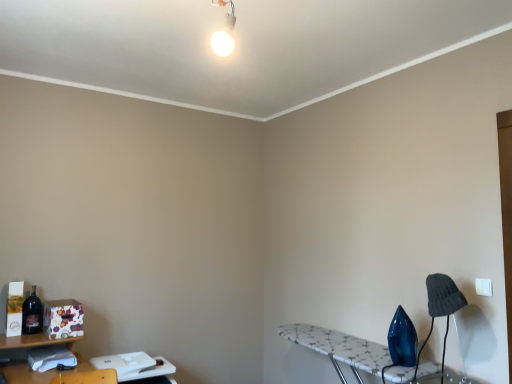
What is the approximate height of dark gray fabric lampshade at lower right?

50.59 centimeters.

The width and height of the screenshot is (512, 384). What do you see at coordinates (348, 352) in the screenshot?
I see `white mosaic ironing board at lower right, the second table from the left` at bounding box center [348, 352].

The image size is (512, 384). Find the location of `matte dark blue bottle at left`. matte dark blue bottle at left is located at coordinates (32, 314).

From a real-world perspective, is matte dark blue bottle at left positioned above or below white plastic table at lower left, which is counted as the 1th table, starting from the left?

Clearly, from a real-world perspective, matte dark blue bottle at left is above white plastic table at lower left, which is counted as the 1th table, starting from the left.

Considering the relative sizes of matte dark blue bottle at left and white plastic table at lower left, which is the 2th table from right to left, in the image provided, is matte dark blue bottle at left shorter than white plastic table at lower left, which is the 2th table from right to left,?

Yes, matte dark blue bottle at left is shorter than white plastic table at lower left, which is the 2th table from right to left.

From the image's perspective, is matte dark blue bottle at left located beneath white plastic table at lower left, which is the 2th table from right to left?

No, from the image's perspective, matte dark blue bottle at left is not beneath white plastic table at lower left, which is the 2th table from right to left.

Considering their positions, is white plastic table at lower left, which is counted as the 1th table, starting from the left, located in front of or behind matte dark blue bottle at left?

In the image, white plastic table at lower left, which is counted as the 1th table, starting from the left, appears in front of matte dark blue bottle at left.

Would you say white plastic table at lower left, which is counted as the 1th table, starting from the left, is to the left or to the right of matte dark blue bottle at left in the picture?

white plastic table at lower left, which is counted as the 1th table, starting from the left, is to the right of matte dark blue bottle at left.

From a real-world perspective, between white plastic table at lower left, which is the 2th table from right to left, and matte dark blue bottle at left, who is vertically lower?

white plastic table at lower left, which is the 2th table from right to left, is physically lower.

Are white plastic table at lower left, which is counted as the 1th table, starting from the left, and matte dark blue bottle at left located far from each other?

No, white plastic table at lower left, which is counted as the 1th table, starting from the left, is not far from matte dark blue bottle at left.

Is white mosaic ironing board at lower right, positioned as the first table in right-to-left order, facing towards matte dark blue bottle at left?

Yes, white mosaic ironing board at lower right, positioned as the first table in right-to-left order, faces towards matte dark blue bottle at left.

Does white mosaic ironing board at lower right, positioned as the first table in right-to-left order, touch matte dark blue bottle at left?

There is a gap between white mosaic ironing board at lower right, positioned as the first table in right-to-left order, and matte dark blue bottle at left.

Does white mosaic ironing board at lower right, the second table from the left, come behind matte dark blue bottle at left?

No, white mosaic ironing board at lower right, the second table from the left, is in front of matte dark blue bottle at left.

In terms of height, does white mosaic ironing board at lower right, positioned as the first table in right-to-left order, look taller or shorter compared to matte dark blue bottle at left?

Considering their sizes, white mosaic ironing board at lower right, positioned as the first table in right-to-left order, has more height than matte dark blue bottle at left.

Between white plastic table at lower left, which is counted as the 1th table, starting from the left, and white glossy bulb at upper center, which one has more height?

white glossy bulb at upper center is taller.

From the image's perspective, is white plastic table at lower left, which is counted as the 1th table, starting from the left, below white glossy bulb at upper center?

Indeed, from the image's perspective, white plastic table at lower left, which is counted as the 1th table, starting from the left, is shown beneath white glossy bulb at upper center.

How many degrees apart are the facing directions of white plastic table at lower left, which is counted as the 1th table, starting from the left, and white glossy bulb at upper center?

white plastic table at lower left, which is counted as the 1th table, starting from the left, and white glossy bulb at upper center are facing 92 degrees away from each other.

Is point (136, 354) positioned before point (232, 23)?

No.

From a real-world perspective, is white glossy bulb at upper center positioned above or below matte dark blue bottle at left?

white glossy bulb at upper center is above matte dark blue bottle at left.

Based on the photo, is white glossy bulb at upper center oriented away from matte dark blue bottle at left?

No, matte dark blue bottle at left is not at the back of white glossy bulb at upper center.

Which is behind, point (226, 15) or point (23, 311)?

The point (23, 311) is more distant.

Would you say white glossy bulb at upper center is inside or outside matte dark blue bottle at left?

white glossy bulb at upper center exists outside the volume of matte dark blue bottle at left.

Considering their positions, is white glossy bulb at upper center located in front of or behind dark gray fabric lampshade at lower right?

In the image, white glossy bulb at upper center appears in front of dark gray fabric lampshade at lower right.

Is white glossy bulb at upper center not close to dark gray fabric lampshade at lower right?

That's right, there is a large distance between white glossy bulb at upper center and dark gray fabric lampshade at lower right.

From a real-world perspective, is white glossy bulb at upper center physically located above or below dark gray fabric lampshade at lower right?

From a real-world perspective, white glossy bulb at upper center is physically above dark gray fabric lampshade at lower right.

From the picture: Can you confirm if white glossy bulb at upper center is positioned to the right of dark gray fabric lampshade at lower right?

In fact, white glossy bulb at upper center is to the left of dark gray fabric lampshade at lower right.

From the image's perspective, is matte dark blue bottle at left beneath white glossy bulb at upper center?

Correct, matte dark blue bottle at left appears lower than white glossy bulb at upper center in the image.

Who is smaller, matte dark blue bottle at left or white glossy bulb at upper center?

Smaller between the two is matte dark blue bottle at left.

Is matte dark blue bottle at left oriented towards white glossy bulb at upper center?

No, matte dark blue bottle at left does not turn towards white glossy bulb at upper center.

The height and width of the screenshot is (384, 512). I want to click on bottle that appears behind the white plastic table at lower left, which is counted as the 1th table, starting from the left, so click(x=32, y=314).

From the image's perspective, which table is the 2nd one below the matte dark blue bottle at left? Please provide its 2D coordinates.

[(134, 366)]

Which object lies nearer to the anchor point matte dark blue bottle at left, white plastic table at lower left, which is the 2th table from right to left, or dark gray fabric lampshade at lower right?

white plastic table at lower left, which is the 2th table from right to left.

Looking at the image, which one is located further to white mosaic ironing board at lower right, positioned as the first table in right-to-left order, white glossy bulb at upper center or white plastic table at lower left, which is counted as the 1th table, starting from the left?

Among the two, white glossy bulb at upper center is located further to white mosaic ironing board at lower right, positioned as the first table in right-to-left order.

Based on their spatial positions, is dark gray fabric lampshade at lower right or white plastic table at lower left, which is the 2th table from right to left, further from matte dark blue bottle at left?

The object further to matte dark blue bottle at left is dark gray fabric lampshade at lower right.

From the image, which object appears to be farther from white mosaic ironing board at lower right, the second table from the left, matte dark blue bottle at left or dark gray fabric lampshade at lower right?

matte dark blue bottle at left.

Estimate the real-world distances between objects in this image. Which object is closer to white glossy bulb at upper center, white mosaic ironing board at lower right, the second table from the left, or white plastic table at lower left, which is the 2th table from right to left?

white mosaic ironing board at lower right, the second table from the left, is closer to white glossy bulb at upper center.

Estimate the real-world distances between objects in this image. Which object is closer to white mosaic ironing board at lower right, positioned as the first table in right-to-left order, white plastic table at lower left, which is the 2th table from right to left, or dark gray fabric lampshade at lower right?

Based on the image, dark gray fabric lampshade at lower right appears to be nearer to white mosaic ironing board at lower right, positioned as the first table in right-to-left order.

Considering their positions, is white plastic table at lower left, which is counted as the 1th table, starting from the left, positioned further to white glossy bulb at upper center than white mosaic ironing board at lower right, the second table from the left?

The object further to white glossy bulb at upper center is white plastic table at lower left, which is counted as the 1th table, starting from the left.

Considering their positions, is dark gray fabric lampshade at lower right positioned further to white glossy bulb at upper center than white mosaic ironing board at lower right, positioned as the first table in right-to-left order?

white mosaic ironing board at lower right, positioned as the first table in right-to-left order, is further to white glossy bulb at upper center.

You are a GUI agent. You are given a task and a screenshot of the screen. Output one action in this format:
    pyautogui.click(x=<x>, y=<y>)
    Task: Click on the table between white plastic table at lower left, which is the 2th table from right to left, and dark gray fabric lampshade at lower right from left to right
    
    Given the screenshot: What is the action you would take?
    pyautogui.click(x=348, y=352)

Locate an element on the screen. The image size is (512, 384). table lamp between white glossy bulb at upper center and white mosaic ironing board at lower right, the second table from the left, from top to bottom is located at coordinates (441, 308).

You are a GUI agent. You are given a task and a screenshot of the screen. Output one action in this format:
    pyautogui.click(x=<x>, y=<y>)
    Task: Click on the light fixture between matte dark blue bottle at left and dark gray fabric lampshade at lower right
    This screenshot has width=512, height=384.
    Given the screenshot: What is the action you would take?
    [224, 31]

Locate an element on the screen. The width and height of the screenshot is (512, 384). table between matte dark blue bottle at left and white mosaic ironing board at lower right, positioned as the first table in right-to-left order, in the horizontal direction is located at coordinates (134, 366).